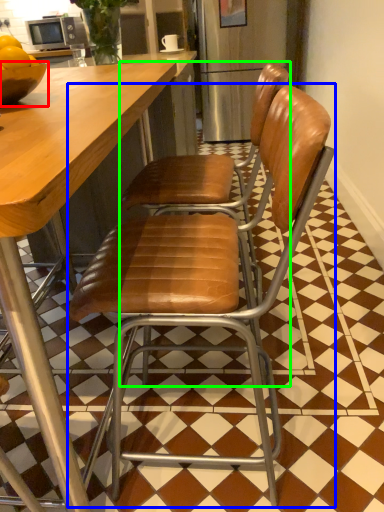
Question: Which object is positioned closest to bowl (highlighted by a red box)? Select from chair (highlighted by a blue box) and chair (highlighted by a green box).

Choices:
 (A) chair
 (B) chair

Answer: (B)